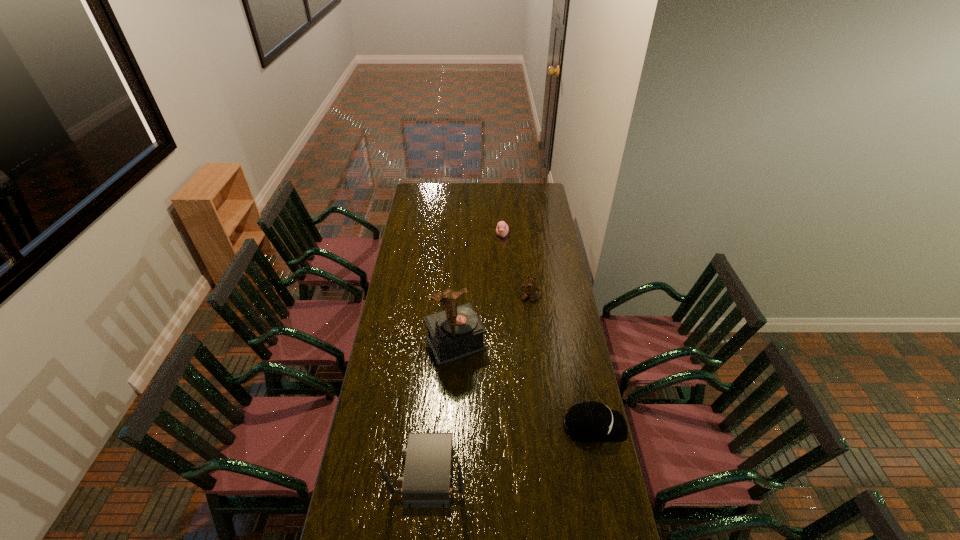
Find the location of a particular element. router is located at coordinates (426, 480).

Locate an element on the screen. The height and width of the screenshot is (540, 960). cap is located at coordinates (588, 421).

Where is `the third object from right to left`? the third object from right to left is located at coordinates (502, 229).

At what (x,y) coordinates should I click in order to perform the action: click on the farthest object. Please return your answer as a coordinate pair (x, y). The width and height of the screenshot is (960, 540). Looking at the image, I should click on (502, 229).

Find the location of a particular element. teddy bear is located at coordinates (530, 288).

Where is `the second object from right to left`? This screenshot has height=540, width=960. the second object from right to left is located at coordinates (530, 288).

Where is `the tallest object`? the tallest object is located at coordinates (457, 332).

Where is `phonograph_record`? The height and width of the screenshot is (540, 960). phonograph_record is located at coordinates (457, 332).

You are a GUI agent. You are given a task and a screenshot of the screen. Output one action in this format:
    pyautogui.click(x=<x>, y=<y>)
    Task: Click on the vacant space located 0.120m on the back of the router to connect cables
    The height and width of the screenshot is (540, 960).
    Given the screenshot: What is the action you would take?
    pyautogui.click(x=360, y=469)

The height and width of the screenshot is (540, 960). What are the coordinates of `free space located on the front-facing side of the duckling` in the screenshot? It's located at (502, 253).